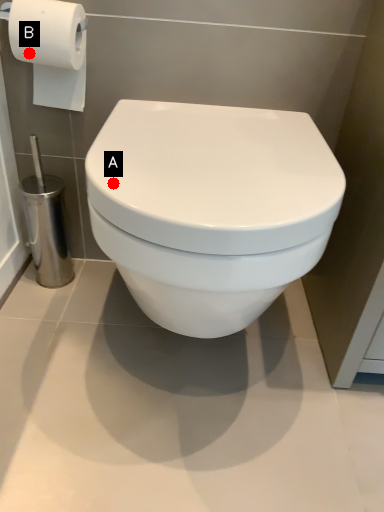
Question: Two points are circled on the image, labeled by A and B beside each circle. Among these points, which one is farthest from the camera?

Choices:
 (A) A is further
 (B) B is further

Answer: (B)